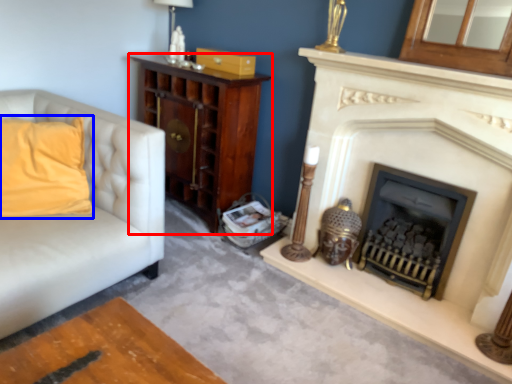
Question: Which point is closer to the camera, cabinetry (highlighted by a red box) or pillow (highlighted by a blue box)?

Choices:
 (A) cabinetry
 (B) pillow

Answer: (B)